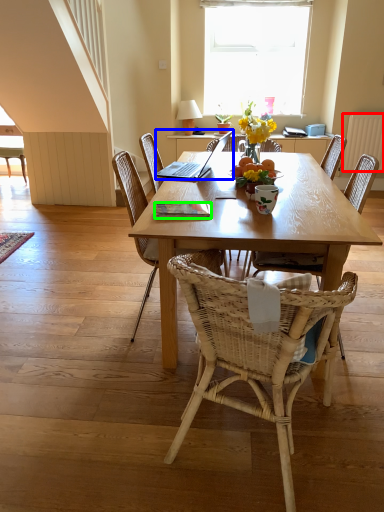
Question: Which is farther away from radiator (highlighted by a red box)? laptop (highlighted by a blue box) or book (highlighted by a green box)?

Choices:
 (A) laptop
 (B) book

Answer: (B)